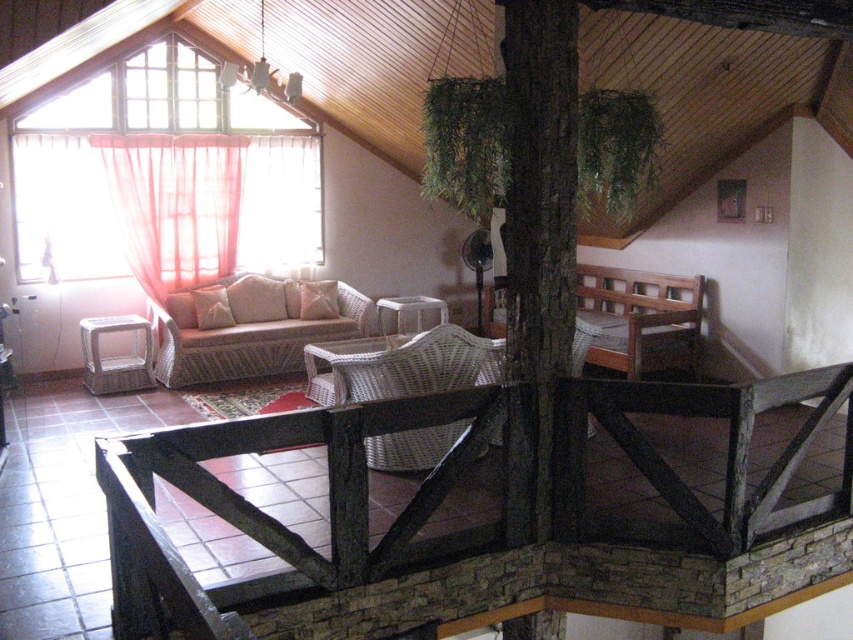
Is woven beige couch at center thinner than white woven pillow at center?

In fact, woven beige couch at center might be wider than white woven pillow at center.

Looking at this image, does woven beige couch at center appear on the right side of white woven pillow at center?

No, woven beige couch at center is not to the right of white woven pillow at center.

What are the coordinates of `woven beige couch at center` in the screenshot? It's located at (253, 326).

Is woven rattan chair at lower left closer to the viewer compared to beige woven pillow at center?

Yes, woven rattan chair at lower left is in front of beige woven pillow at center.

Is woven rattan chair at lower left thinner than beige woven pillow at center?

No.

The image size is (853, 640). In order to click on woven rattan chair at lower left in this screenshot , I will do [x=115, y=355].

This screenshot has width=853, height=640. I want to click on woven rattan chair at lower left, so click(x=115, y=355).

Based on the photo, can you confirm if woven beige couch at center is thinner than white fabric pillow at center?

No.

How distant is woven beige couch at center from white fabric pillow at center?

woven beige couch at center is 28.09 centimeters away from white fabric pillow at center.

Who is more forward, (157, 320) or (213, 326)?

Point (157, 320) is in front.

Locate an element on the screen. woven beige couch at center is located at coordinates (253, 326).